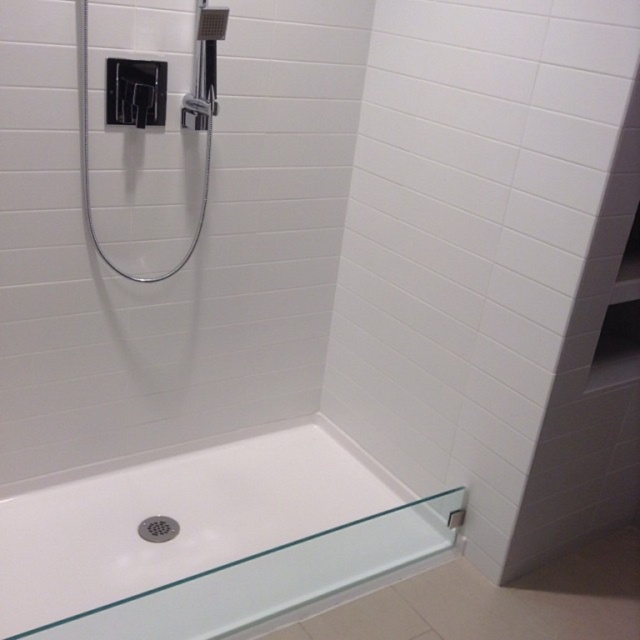
You are a bathroom designer planning to place a new shelf between the white glossy bathtub at lower center and the black matte shower door at upper left. Based on their positions, which side of the shelf should face towards the bathtub?

The white glossy bathtub at lower center is to the right of the black matte shower door at upper left. Therefore, the right side of the shelf should face towards the bathtub.

You are standing in the shower area and want to reach a soap dish located at point (202, 554). Your arm can extend 5 feet. Can you reach it?

The distance of point (202, 554) from viewer is 5.87 feet, so no, you cannot reach it since your arm can only extend 5 feet.